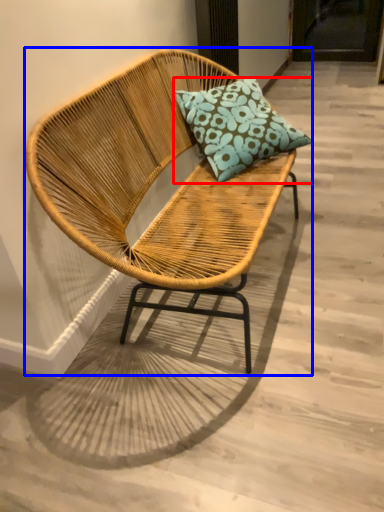
Question: Among these objects, which one is farthest to the camera, pillow (highlighted by a red box) or chair (highlighted by a blue box)?

Choices:
 (A) pillow
 (B) chair

Answer: (A)